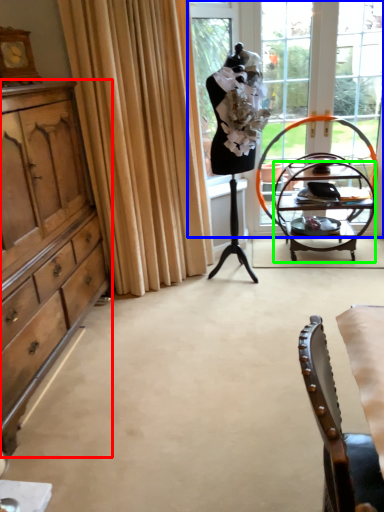
Question: Which object is the farthest from cabinetry (highlighted by a red box)? Choose among these: window (highlighted by a blue box) or desk (highlighted by a green box).

Choices:
 (A) window
 (B) desk

Answer: (B)